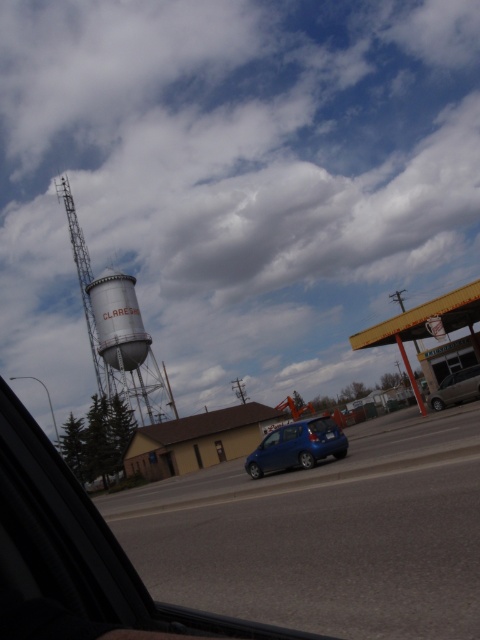
Which is below, satin blue hatchback at center or metallic silver car at lower right?

Positioned lower is satin blue hatchback at center.

Does satin blue hatchback at center have a lesser height compared to metallic silver car at lower right?

No, satin blue hatchback at center is not shorter than metallic silver car at lower right.

Is point (335, 444) closer to viewer compared to point (435, 397)?

Yes, point (335, 444) is closer to viewer.

Find the location of a particular element. This screenshot has width=480, height=640. satin blue hatchback at center is located at coordinates (297, 445).

Who is positioned more to the left, gray concrete water tower at center or satin blue hatchback at center?

gray concrete water tower at center is more to the left.

This screenshot has width=480, height=640. What do you see at coordinates (118, 321) in the screenshot?
I see `gray concrete water tower at center` at bounding box center [118, 321].

You are a GUI agent. You are given a task and a screenshot of the screen. Output one action in this format:
    pyautogui.click(x=<x>, y=<y>)
    Task: Click on the gray concrete water tower at center
    
    Given the screenshot: What is the action you would take?
    pyautogui.click(x=118, y=321)

Identify the location of gray concrete water tower at center. (118, 321).

Who is more forward, [122,298] or [434,404]?

Point [434,404] is more forward.

Is the position of gray concrete water tower at center less distant than that of metallic silver car at lower right?

No, it is not.

Measure the distance between point [130,348] and camera.

A distance of 58.86 meters exists between point [130,348] and camera.

This screenshot has height=640, width=480. Identify the location of gray concrete water tower at center. (118, 321).